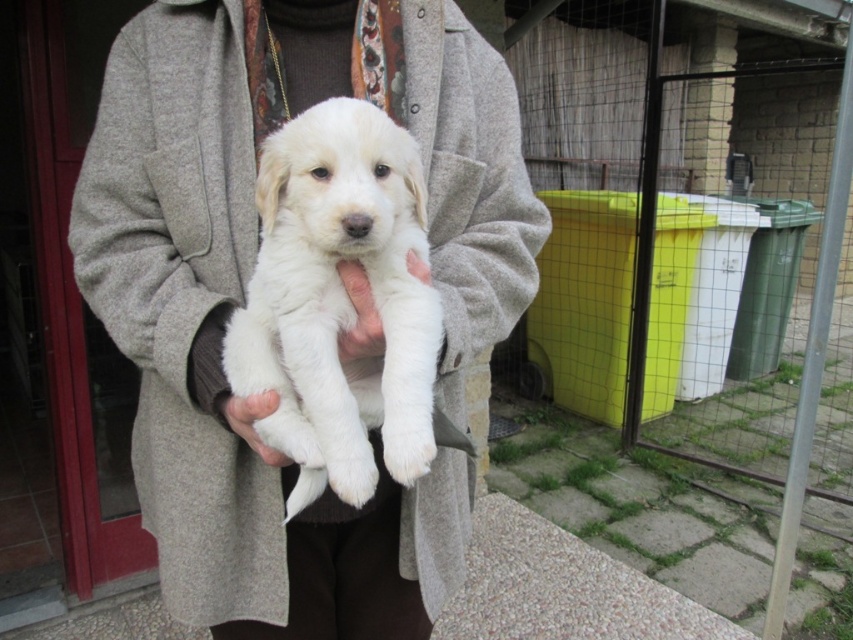
Can you confirm if white fluffy puppy at center is positioned to the left of white fur at center?

In fact, white fluffy puppy at center is to the right of white fur at center.

What do you see at coordinates (338, 301) in the screenshot? I see `white fluffy puppy at center` at bounding box center [338, 301].

Locate an element on the screen. white fluffy puppy at center is located at coordinates (338, 301).

Between white fur puppy at center and white fluffy puppy at center, which one appears on the left side from the viewer's perspective?

From the viewer's perspective, white fur puppy at center appears more on the left side.

Which is more to the right, white fur puppy at center or white fluffy puppy at center?

white fluffy puppy at center

Which is in front, point (230, 557) or point (271, 436)?

Positioned in front is point (271, 436).

Identify the location of white fur puppy at center. The width and height of the screenshot is (853, 640). (245, 284).

What do you see at coordinates (245, 284) in the screenshot? I see `white fur puppy at center` at bounding box center [245, 284].

Between point (223, 289) and point (229, 412), which one is positioned behind?

The point (223, 289) is behind.

I want to click on white fur puppy at center, so click(245, 284).